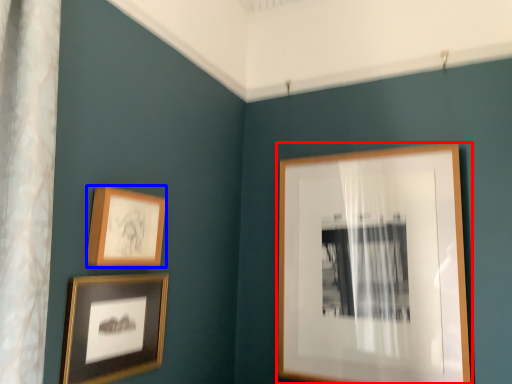
Question: Among these objects, which one is farthest to the camera, picture frame (highlighted by a red box) or picture frame (highlighted by a blue box)?

Choices:
 (A) picture frame
 (B) picture frame

Answer: (A)